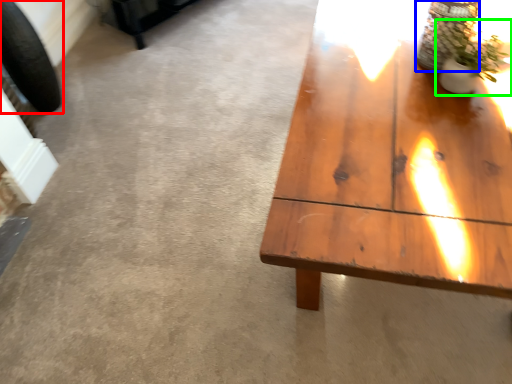
Question: Estimate the real-world distances between objects in this image. Which object is farther from car tire (highlighted by a red box), glass vase (highlighted by a blue box) or houseplant (highlighted by a green box)?

Choices:
 (A) glass vase
 (B) houseplant

Answer: (B)